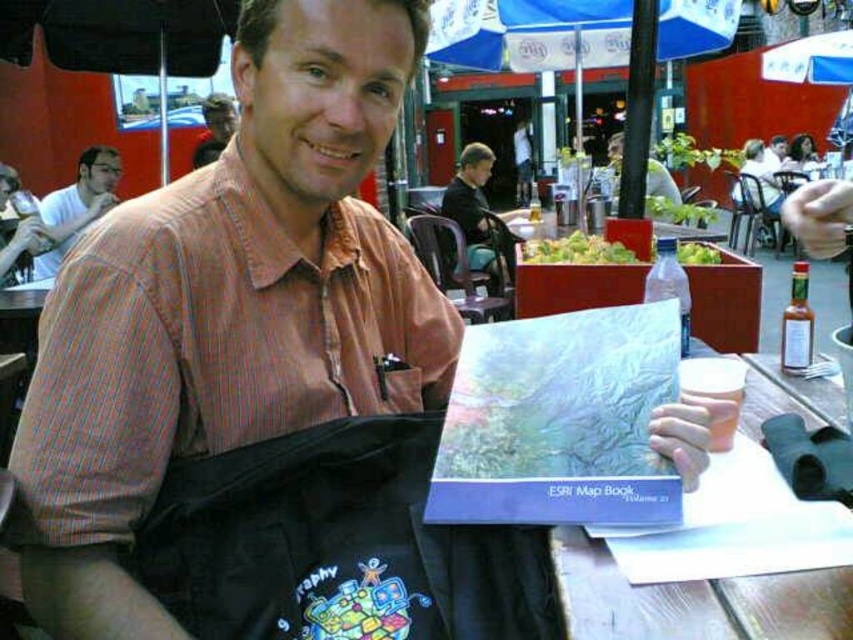
You are a fashion designer observing the scene. You notice the dark brown leather jacket at center and the matte black shirt at upper left. Which item is covering part of the other?

The dark brown leather jacket at center is positioned over the matte black shirt at upper left, so it is covering part of it.

You are a fashion designer observing the outdoor scene. You notice the dark brown leather jacket at center and the smooth brown shirt at upper left. Which clothing item is located lower in the image?

The dark brown leather jacket at center is positioned under the smooth brown shirt at upper left, so it is located lower in the image.

Looking at this image, what are the coordinates of the smooth brown shirt at upper left?

The smooth brown shirt at upper left is located at point (213, 129).